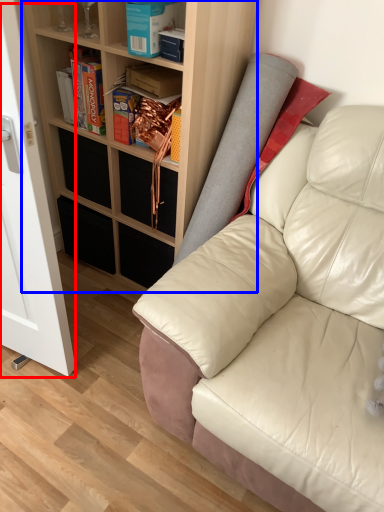
Question: Which of the following is the farthest to the observer, glass door (highlighted by a red box) or shelf (highlighted by a blue box)?

Choices:
 (A) glass door
 (B) shelf

Answer: (B)